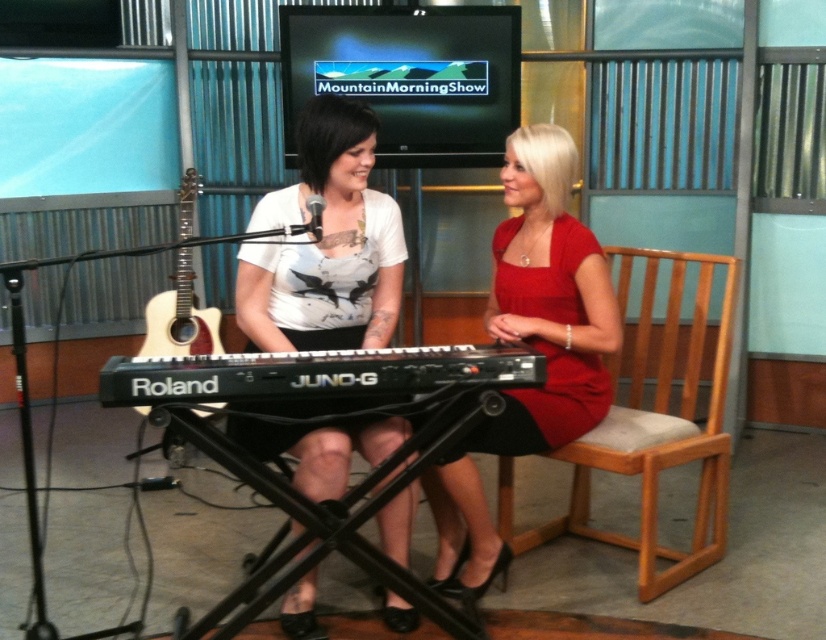
Which is more to the left, white matte shirt at center or red satin dress at right?

From the viewer's perspective, white matte shirt at center appears more on the left side.

This screenshot has width=826, height=640. I want to click on white matte shirt at center, so click(325, 244).

Who is taller, light brown wood chair at right or black plastic roland juno-g keyboard at center?

Standing taller between the two is light brown wood chair at right.

Image resolution: width=826 pixels, height=640 pixels. Identify the location of light brown wood chair at right. (653, 426).

This screenshot has width=826, height=640. Identify the location of light brown wood chair at right. (653, 426).

Identify the location of white matte shirt at center. Image resolution: width=826 pixels, height=640 pixels. (325, 244).

The height and width of the screenshot is (640, 826). I want to click on white matte shirt at center, so click(325, 244).